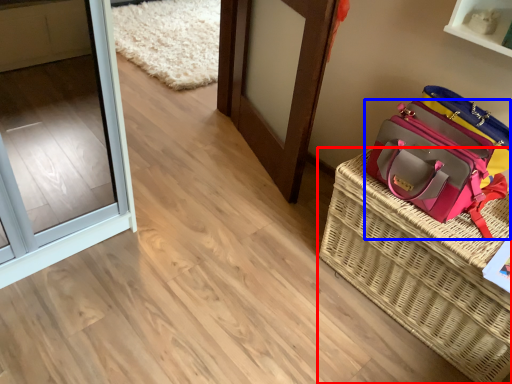
Question: Which of the following is the farthest to the observer, picnic basket (highlighted by a red box) or handbag (highlighted by a blue box)?

Choices:
 (A) picnic basket
 (B) handbag

Answer: (B)